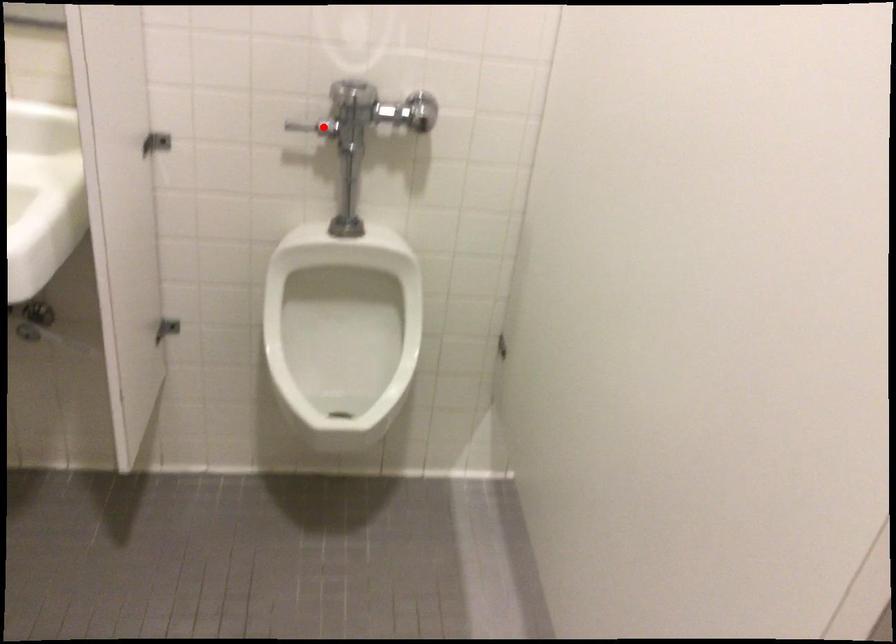
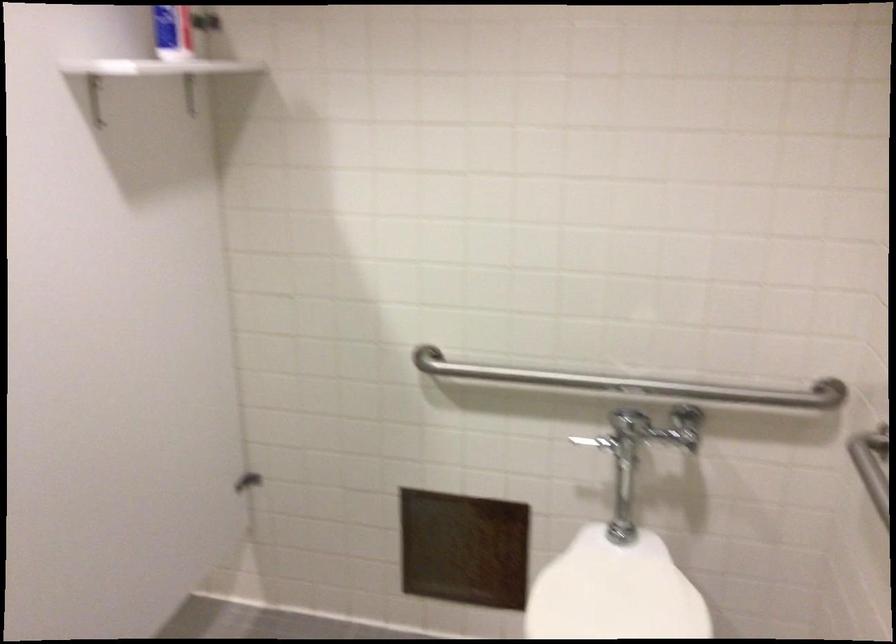
Question: I am providing you with two images of the same scene from different viewpoints. A red point is marked on the first image. Can you still see the location of the red point in image 2?

Choices:
 (A) Yes
 (B) No

Answer: (B)